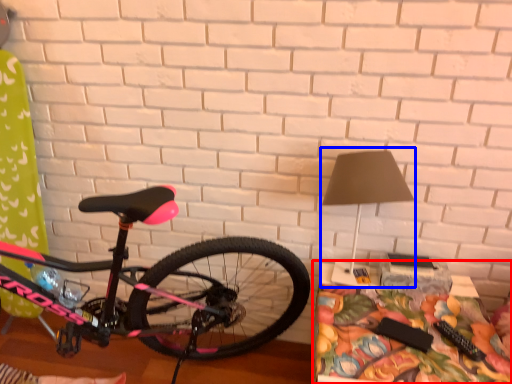
Question: Among these objects, which one is nearest to the camera, table (highlighted by a red box) or table lamp (highlighted by a blue box)?

Choices:
 (A) table
 (B) table lamp

Answer: (A)